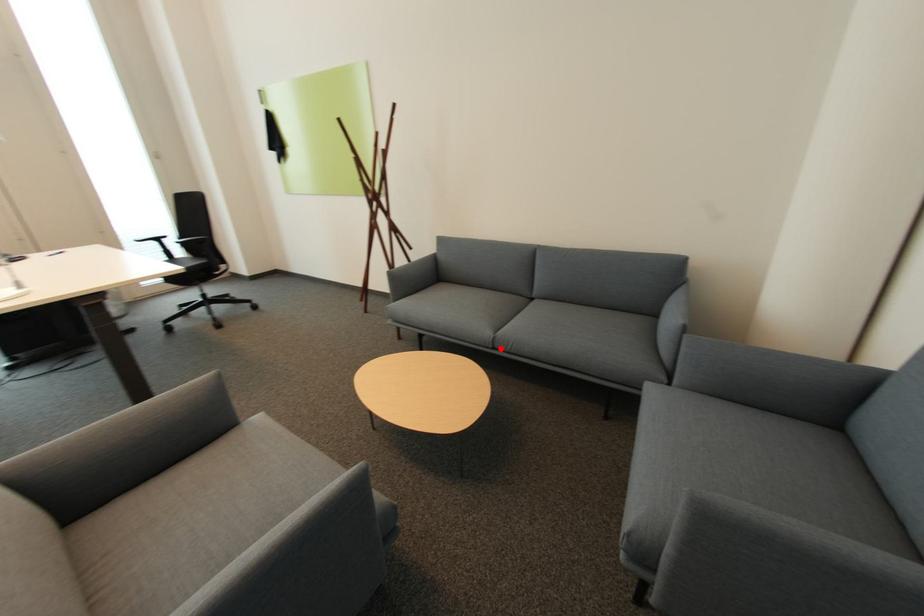
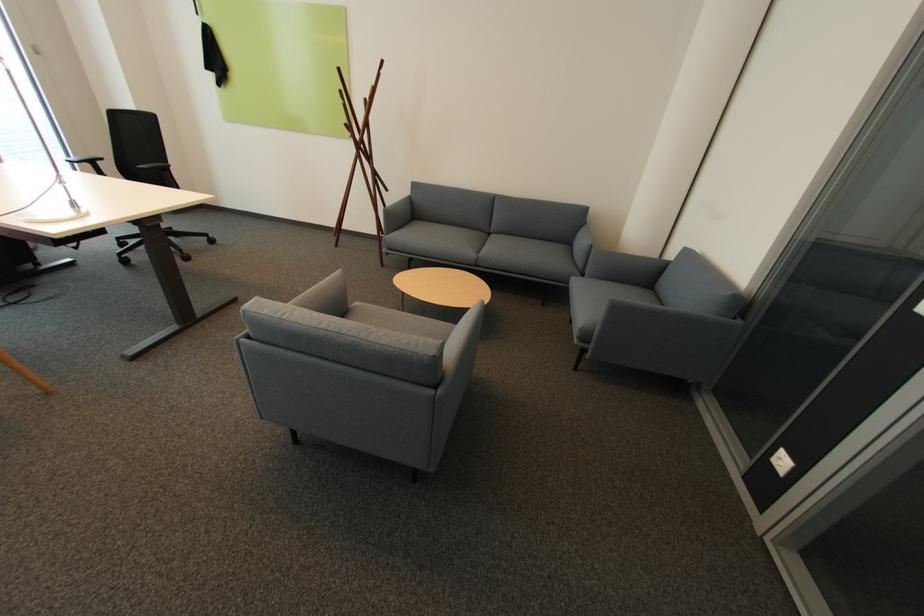
Question: A red point is marked in image1. In image2, is the corresponding 3D point closer to the camera or farther? Reply with the corresponding letter.

Choices:
 (A) The corresponding 3D point is closer.
 (B) The corresponding 3D point is farther.

Answer: (A)